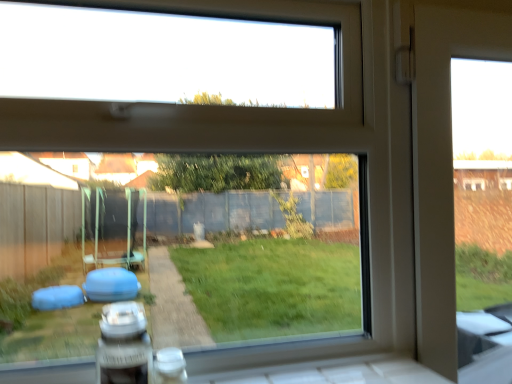
The height and width of the screenshot is (384, 512). Identify the location of white plastic car at lower left. (123, 345).

Image resolution: width=512 pixels, height=384 pixels. Describe the element at coordinates (123, 345) in the screenshot. I see `white plastic car at lower left` at that location.

Locate an element on the screen. Image resolution: width=512 pixels, height=384 pixels. white plastic car at lower left is located at coordinates (123, 345).